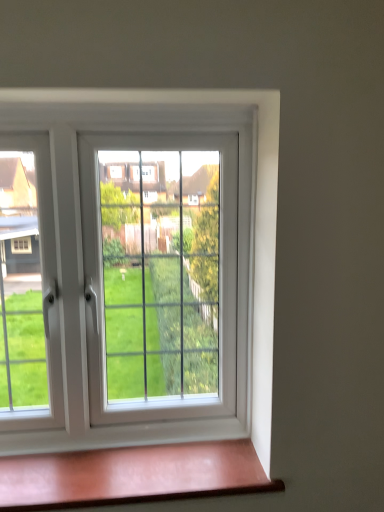
Question: In terms of width, does white plastic window at center look wider or thinner when compared to matte pink wood at lower center?

Choices:
 (A) wide
 (B) thin

Answer: (B)

Question: In terms of size, does white plastic window at center appear bigger or smaller than matte pink wood at lower center?

Choices:
 (A) small
 (B) big

Answer: (B)

Question: Is white plastic window at center inside the boundaries of matte pink wood at lower center, or outside?

Choices:
 (A) inside
 (B) outside

Answer: (B)

Question: From the image's perspective, relative to white plastic window at center, is matte pink wood at lower center above or below?

Choices:
 (A) above
 (B) below

Answer: (B)

Question: From a real-world perspective, is matte pink wood at lower center positioned above or below white plastic window at center?

Choices:
 (A) above
 (B) below

Answer: (B)

Question: Is point (87, 492) positioned closer to the camera than point (261, 394)?

Choices:
 (A) farther
 (B) closer

Answer: (B)

Question: Would you say matte pink wood at lower center is inside or outside white plastic window at center?

Choices:
 (A) inside
 (B) outside

Answer: (B)